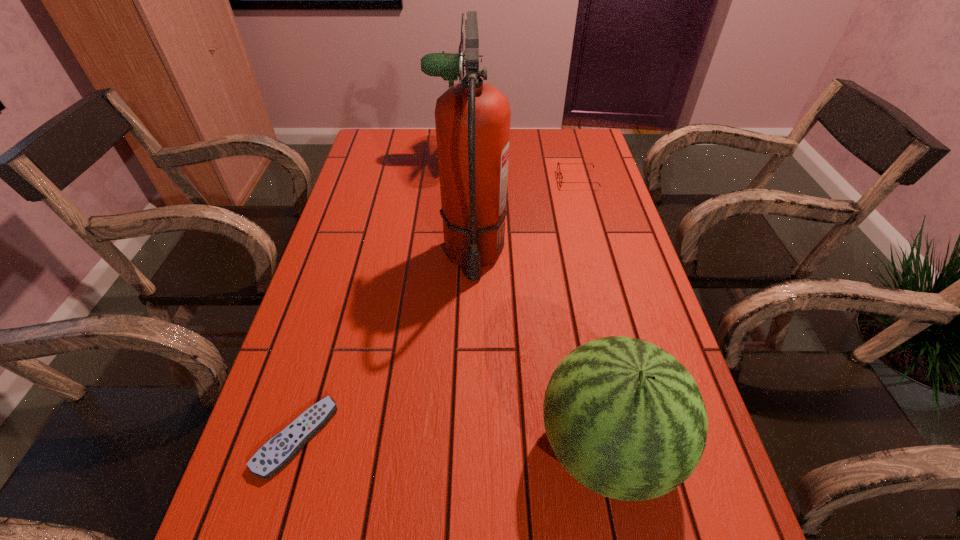
Where is `free space located on the front-facing side of the fourth tallest object`? free space located on the front-facing side of the fourth tallest object is located at coordinates (430, 180).

Image resolution: width=960 pixels, height=540 pixels. I want to click on free region located 0.180m on the front-facing side of the fourth tallest object, so click(501, 180).

The height and width of the screenshot is (540, 960). I want to click on free location located 0.120m on the front-facing side of the fourth tallest object, so click(x=520, y=180).

In order to click on free space located on the back of the remote control in this screenshot , I will do `click(341, 289)`.

Where is `object located in the far edge section of the desktop`? The height and width of the screenshot is (540, 960). object located in the far edge section of the desktop is located at coordinates (434, 64).

You are a GUI agent. You are given a task and a screenshot of the screen. Output one action in this format:
    pyautogui.click(x=<x>, y=<y>)
    Task: Click on the object present at the left edge
    Image resolution: width=960 pixels, height=540 pixels.
    Given the screenshot: What is the action you would take?
    pyautogui.click(x=278, y=451)

The image size is (960, 540). I want to click on watermelon that is at the right edge, so click(625, 418).

Locate an element on the screen. This screenshot has height=540, width=960. sunglasses that is at the right edge is located at coordinates (558, 167).

This screenshot has width=960, height=540. In the image, there is a desktop. What are the coordinates of `vacant space at the left edge` in the screenshot? It's located at (362, 352).

You are a GUI agent. You are given a task and a screenshot of the screen. Output one action in this format:
    pyautogui.click(x=<x>, y=<y>)
    Task: Click on the vacant area at the right edge
    The height and width of the screenshot is (540, 960).
    Given the screenshot: What is the action you would take?
    pyautogui.click(x=588, y=286)